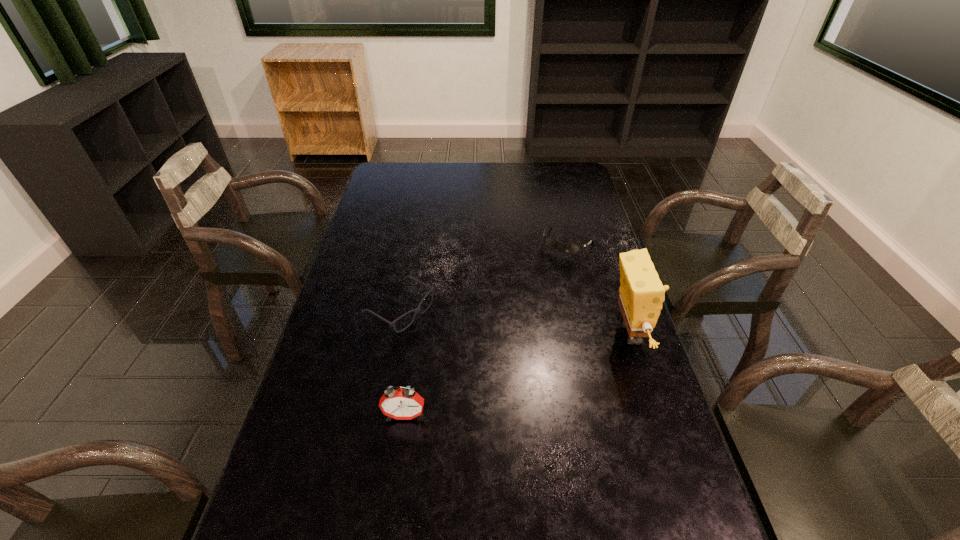
This screenshot has height=540, width=960. What are the coordinates of `vacant space located on the front-facing side of the farthest object` in the screenshot? It's located at (539, 297).

Identify the location of vacant space located 0.070m on the front-facing side of the farthest object. This screenshot has height=540, width=960. (553, 270).

Identify the location of object that is at the left edge. (392, 324).

The image size is (960, 540). Find the location of `sponge positioned at the right edge`. sponge positioned at the right edge is located at coordinates (641, 296).

What are the coordinates of `sunglasses present at the right edge` in the screenshot? It's located at (570, 248).

Locate an element on the screen. Image resolution: width=960 pixels, height=540 pixels. blank space at the far edge is located at coordinates (488, 170).

Find the location of a particular element. This screenshot has height=540, width=960. vacant space at the left edge of the desktop is located at coordinates (396, 217).

In the image, there is a desktop. At what (x,y) coordinates should I click in order to perform the action: click on free space at the right edge. Please return your answer as a coordinate pair (x, y). This screenshot has width=960, height=540. Looking at the image, I should click on (675, 447).

Identify the location of free location at the far left corner. (382, 163).

You are a GUI agent. You are given a task and a screenshot of the screen. Output one action in this format:
    pyautogui.click(x=<x>, y=<y>)
    Task: Click on the vacant space that is in between the sponge and the farthest object
    
    Given the screenshot: What is the action you would take?
    pyautogui.click(x=599, y=288)